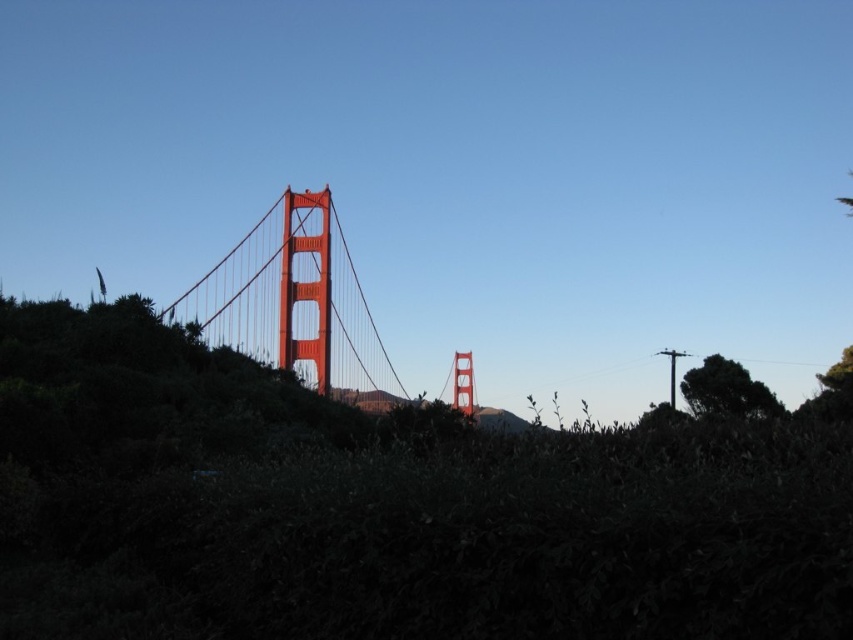
Does glossy steel bridge at center appear on the right side of green leafy tree at right?

Incorrect, glossy steel bridge at center is not on the right side of green leafy tree at right.

Does glossy steel bridge at center have a lesser width compared to green leafy tree at right?

No.

Is point (207, 324) positioned behind point (769, 408)?

Yes, it is behind point (769, 408).

The height and width of the screenshot is (640, 853). I want to click on glossy steel bridge at center, so click(x=296, y=305).